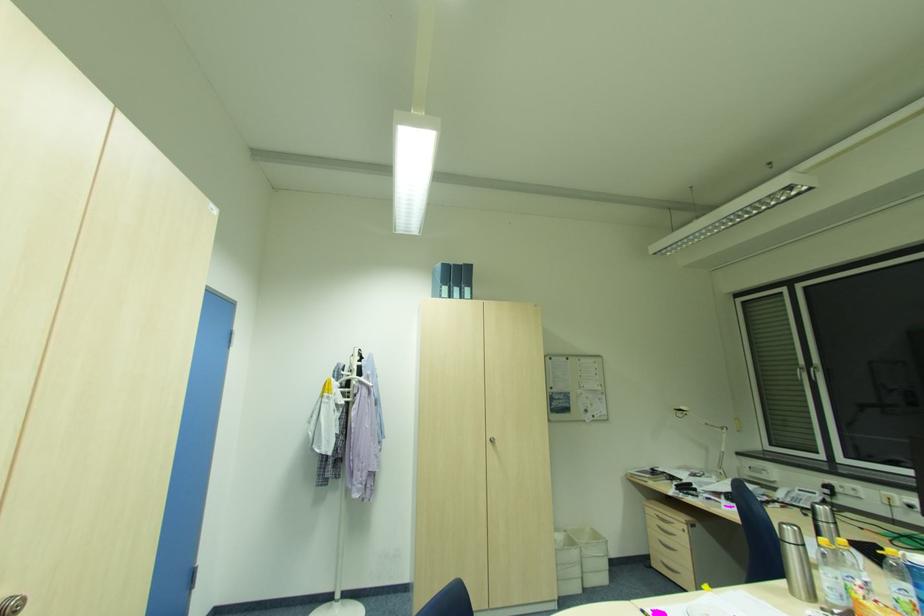
Where would you turn the window handle? Please return your answer as a coordinate pair (x, y).

(13, 604)